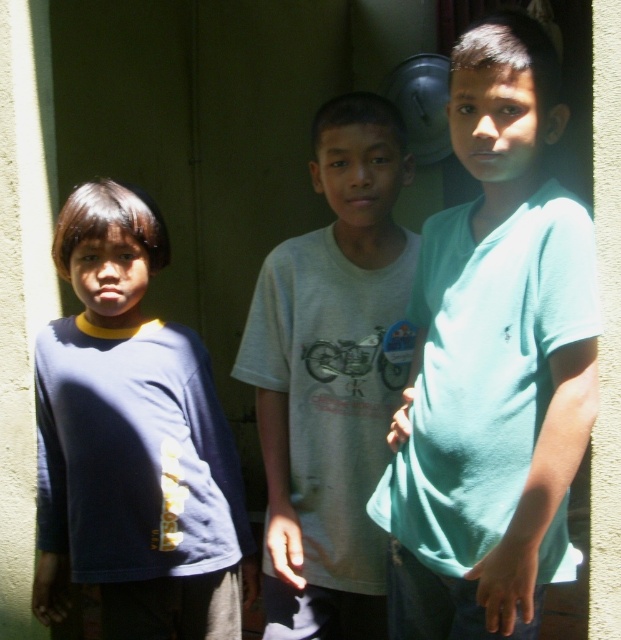
Question: Which of the following is the closest to the observer?

Choices:
 (A) (68, 280)
 (B) (442, 456)
 (C) (288, 285)

Answer: (B)

Question: Based on their relative distances, which object is farther from the white cotton shirt at center?

Choices:
 (A) dark blue t-shirt at left
 (B) teal matte shirt at center

Answer: (A)

Question: Is teal matte shirt at center smaller than dark blue t-shirt at left?

Choices:
 (A) no
 (B) yes

Answer: (A)

Question: Does dark blue t-shirt at left lie behind white cotton shirt at center?

Choices:
 (A) no
 (B) yes

Answer: (B)

Question: Which of the following is the closest to the observer?

Choices:
 (A) teal matte shirt at center
 (B) dark blue t-shirt at left
 (C) white cotton shirt at center

Answer: (A)

Question: Does teal matte shirt at center have a smaller size compared to white cotton shirt at center?

Choices:
 (A) yes
 (B) no

Answer: (B)